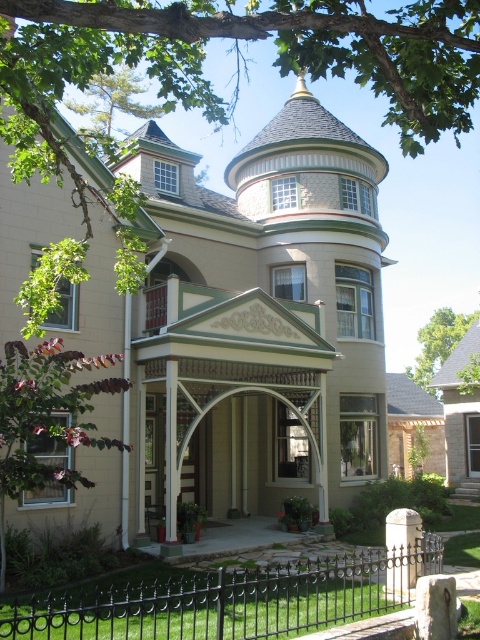
You are a delivery person trying to determine if your 1.2 meter wide package can fit through the space between the black wrought iron fence at lower center and the white stone pillar at lower right. Can the package fit through the space?

The black wrought iron fence at lower center might be wider than white stone pillar at lower right, so the space between them may be sufficient for the 1.2 meter wide package. However, since the exact width isn generated, it is recommended to measure the space before attempting to move the package through.

Based on the photo, you are a delivery person trying to determine the distance between the black wrought iron fence at lower center and the white stone pillar at lower right. According to the image, how far apart are these two objects?

The black wrought iron fence at lower center is 10.16 feet from the white stone pillar at lower right, so the distance between them is exactly 10.16 feet.